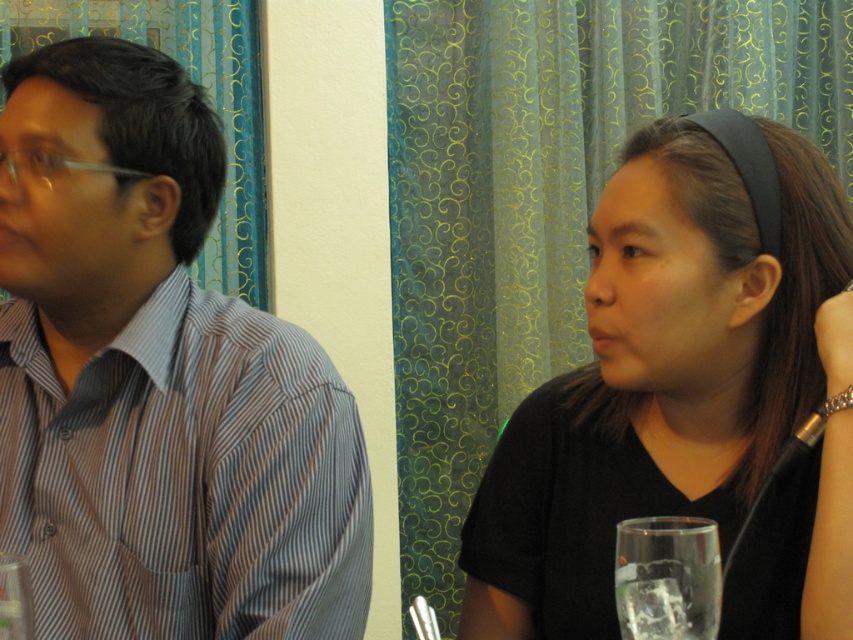
You are a photographer setting up for a portrait. You need to ensure that both the black matte shirt at center and the clear glass at lower right are in focus. Which object should you focus on first to ensure depth of field covers both?

You should focus on the black matte shirt at center first because it is closer to the viewer than the clear glass at lower right, allowing the depth of field to extend backward to include the glass.